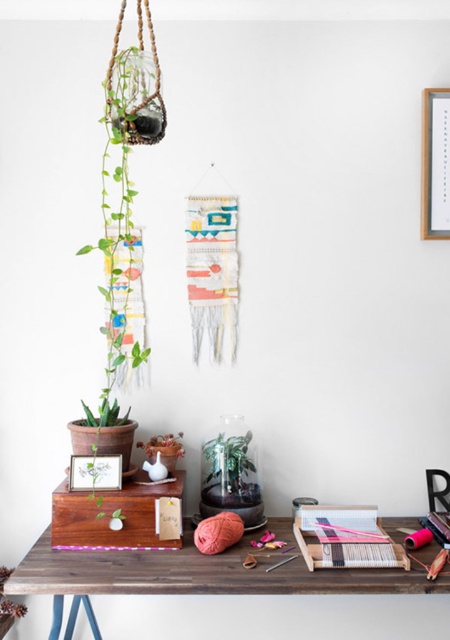
Question: Which of the following is the farthest from the observer?

Choices:
 (A) (368, 589)
 (B) (103, 257)
 (C) (226, 506)
 (D) (448, 90)

Answer: (B)

Question: Which point is farther to the camera?

Choices:
 (A) matte wood picture frame at lower left
 (B) green leafy plant at left
 (C) wooden picture frame at upper right
 (D) wooden table at lower center

Answer: (C)

Question: In this image, where is wooden table at lower center located relative to matte wood picture frame at lower left?

Choices:
 (A) left
 (B) right

Answer: (B)

Question: Can you confirm if wooden picture frame at upper right is positioned above knitted pink yarn at center?

Choices:
 (A) no
 (B) yes

Answer: (B)

Question: Can you confirm if wooden picture frame at upper right is bigger than knitted pink yarn at center?

Choices:
 (A) yes
 (B) no

Answer: (A)

Question: Which object appears farthest from the camera in this image?

Choices:
 (A) green leafy plant at left
 (B) matte wood picture frame at lower left

Answer: (B)